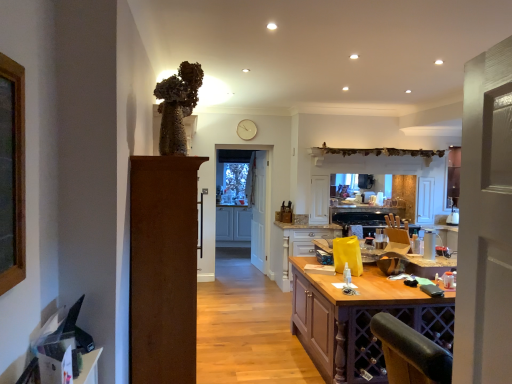
Question: In the image, is white glossy cabinets at center, arranged as the 2th cabinetry when viewed from the right, on the left side or the right side of clear glass door at center?

Choices:
 (A) left
 (B) right

Answer: (A)

Question: Considering the positions of white glossy cabinets at center, which is the second cabinetry in front-to-back order, and clear glass door at center in the image, is white glossy cabinets at center, which is the second cabinetry in front-to-back order, taller or shorter than clear glass door at center?

Choices:
 (A) tall
 (B) short

Answer: (B)

Question: Which object is the closest to the white wooden door at center, the first door viewed from the back?

Choices:
 (A) purple wood table at center
 (B) white glossy cabinets at center, marked as the 1th cabinetry in a left-to-right arrangement
 (C) white plastic spray bottle at center
 (D) clear glass door at center
 (E) brown wood door at left, marked as the 1th door in a left-to-right arrangement

Answer: (D)

Question: Considering the real-world distances, which object is farthest from the clear glass door at center?

Choices:
 (A) white glossy cabinets at center, which is the second cabinetry in front-to-back order
 (B) white wooden door at center, the first door when ordered from right to left
 (C) purple wood table at center
 (D) brown wood door at left, arranged as the first door when viewed from the front
 (E) white plastic spray bottle at center

Answer: (D)